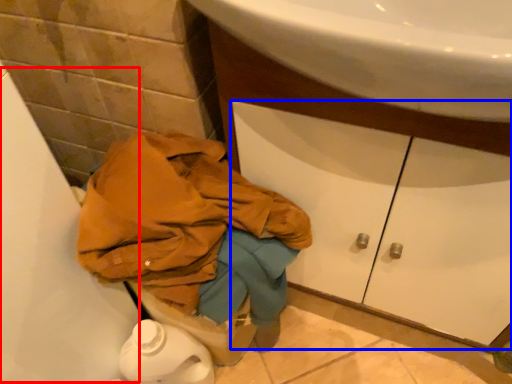
Question: Which object is closer to the camera taking this photo, bath (highlighted by a red box) or drawer (highlighted by a blue box)?

Choices:
 (A) bath
 (B) drawer

Answer: (A)